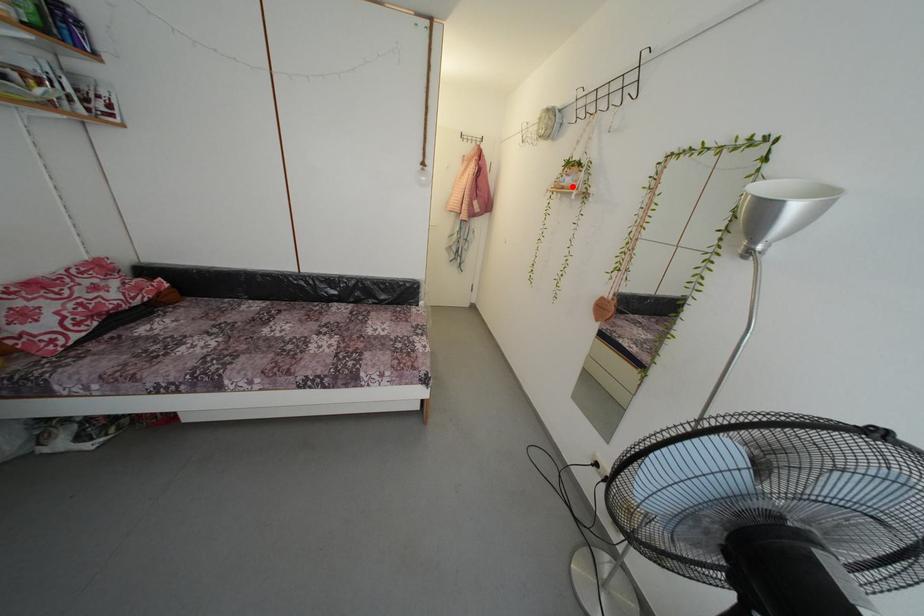
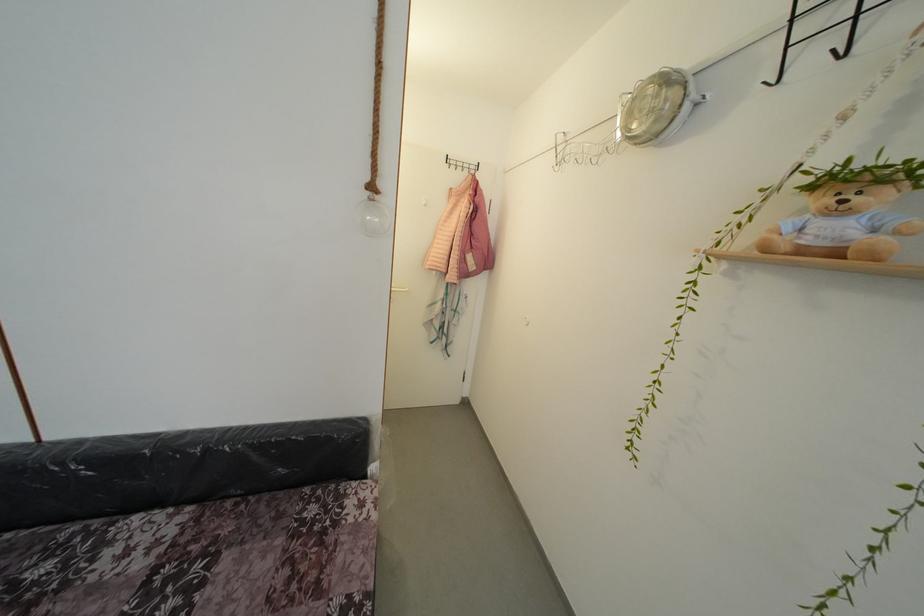
Locate, in the second image, the point that corresponds to the highlighted location in the first image.

(841, 236)